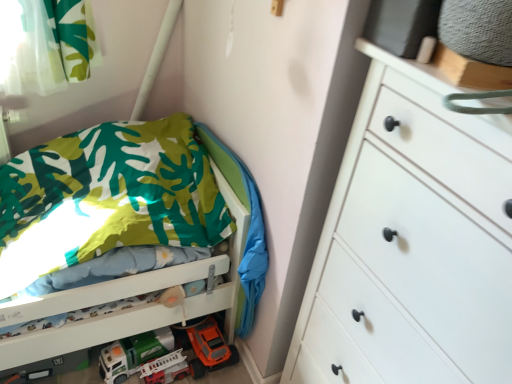
Question: From a real-world perspective, is orange plastic toy car at lower center on matte white plastic fire truck at lower left, marked as the first toy car in a right-to-left arrangement?

Choices:
 (A) yes
 (B) no

Answer: (A)

Question: Can you confirm if orange plastic toy car at lower center is wider than matte white plastic fire truck at lower left, marked as the first toy car in a right-to-left arrangement?

Choices:
 (A) yes
 (B) no

Answer: (B)

Question: Does orange plastic toy car at lower center have a lesser height compared to matte white plastic fire truck at lower left, placed as the 2th toy car when sorted from left to right?

Choices:
 (A) yes
 (B) no

Answer: (B)

Question: Can you confirm if orange plastic toy car at lower center is positioned to the right of matte white plastic fire truck at lower left, marked as the first toy car in a right-to-left arrangement?

Choices:
 (A) yes
 (B) no

Answer: (A)

Question: Is matte white plastic fire truck at lower left, placed as the 2th toy car when sorted from left to right, surrounded by orange plastic toy car at lower center?

Choices:
 (A) yes
 (B) no

Answer: (B)

Question: Is the depth of orange plastic toy car at lower center less than that of matte white plastic fire truck at lower left, marked as the first toy car in a right-to-left arrangement?

Choices:
 (A) yes
 (B) no

Answer: (B)

Question: Does white plastic toy car at lower center, which is the first toy car in left-to-right order, come behind orange plastic toy car at lower center?

Choices:
 (A) yes
 (B) no

Answer: (B)

Question: Is white plastic toy car at lower center, marked as the second toy car in a right-to-left arrangement, thinner than orange plastic toy car at lower center?

Choices:
 (A) yes
 (B) no

Answer: (B)

Question: Does white plastic toy car at lower center, which is the first toy car in left-to-right order, touch orange plastic toy car at lower center?

Choices:
 (A) no
 (B) yes

Answer: (A)

Question: From a real-world perspective, is white plastic toy car at lower center, which is the first toy car in left-to-right order, over orange plastic toy car at lower center?

Choices:
 (A) yes
 (B) no

Answer: (B)

Question: Is white plastic toy car at lower center, which is the first toy car in left-to-right order, smaller than orange plastic toy car at lower center?

Choices:
 (A) yes
 (B) no

Answer: (A)

Question: From the image's perspective, would you say white plastic toy car at lower center, marked as the second toy car in a right-to-left arrangement, is positioned over orange plastic toy car at lower center?

Choices:
 (A) no
 (B) yes

Answer: (B)

Question: Does green fabric blanket at lower left appear on the left side of matte white plastic fire truck at lower left, placed as the 2th toy car when sorted from left to right?

Choices:
 (A) no
 (B) yes

Answer: (A)